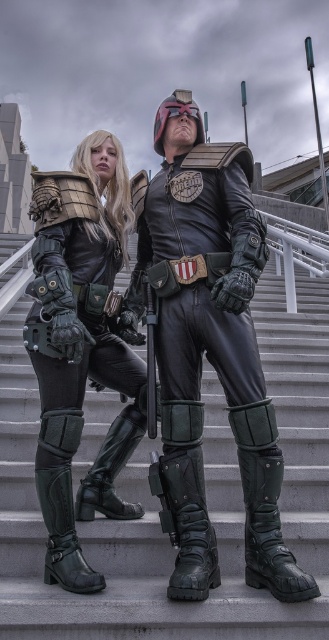
You are a photographer standing at the base of the gray concrete stairs at center. You want to take a photo of the two costumed characters standing on the stairs. If your camera has a maximum zoom range of 4.5 meters, will you be able to capture them clearly without moving closer?

The gray concrete stairs at center are 4.60 meters away from the camera. Since the camera can only zoom up to 4.5 meters, you will not be able to capture the characters clearly without moving closer.

You are a costume designer analyzing the image. You need to determine where the leather and metallic armor is located relative to the two costumed individuals. Based on the coordinates provided, can you identify which character the armor at point (x=209, y=348) belongs to?

The armor at point (x=209, y=348) is located at the center of the image, between the two individuals. Since the female character is on the left and the male on the right, the armor is likely part of the male character as he is positioned closer to the center.